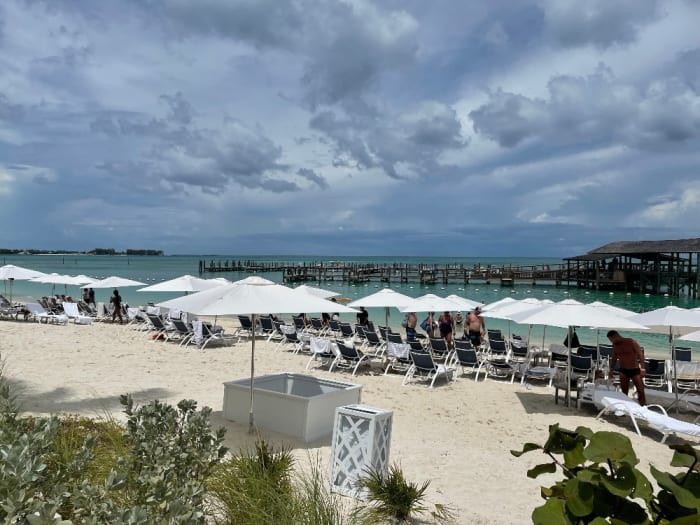
At what (x,y) coordinates should I click in order to perform the action: click on garbage can. Please return your answer as a coordinate pair (x, y). Image resolution: width=700 pixels, height=525 pixels. Looking at the image, I should click on (371, 430).